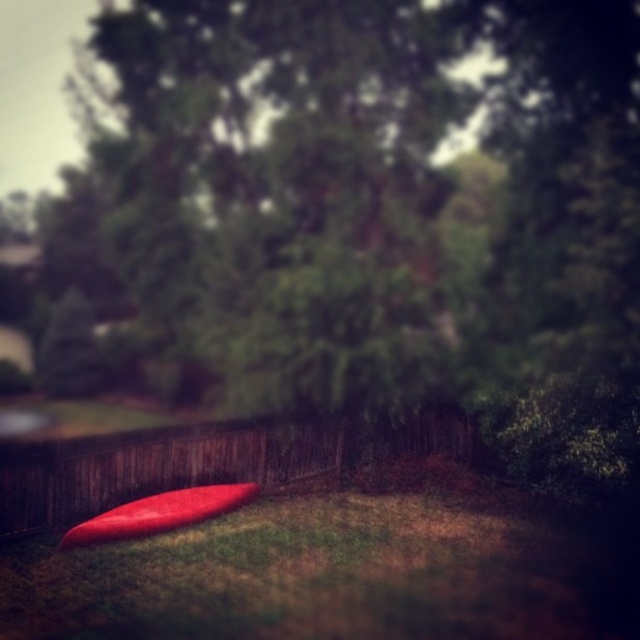
Question: Can you confirm if wooden fence at lower left is positioned to the left of glossy red surfboard at center?

Choices:
 (A) no
 (B) yes

Answer: (A)

Question: Is the position of wooden fence at lower left more distant than that of glossy red surfboard at center?

Choices:
 (A) no
 (B) yes

Answer: (B)

Question: Which of the following is the farthest from the observer?

Choices:
 (A) wooden fence at lower left
 (B) glossy red surfboard at center

Answer: (A)

Question: Does wooden fence at lower left appear over glossy red surfboard at center?

Choices:
 (A) no
 (B) yes

Answer: (B)

Question: Which point is farther to the camera?

Choices:
 (A) (257, 486)
 (B) (330, 448)

Answer: (B)

Question: Which object appears farthest from the camera in this image?

Choices:
 (A) glossy red surfboard at center
 (B) wooden fence at lower left

Answer: (B)